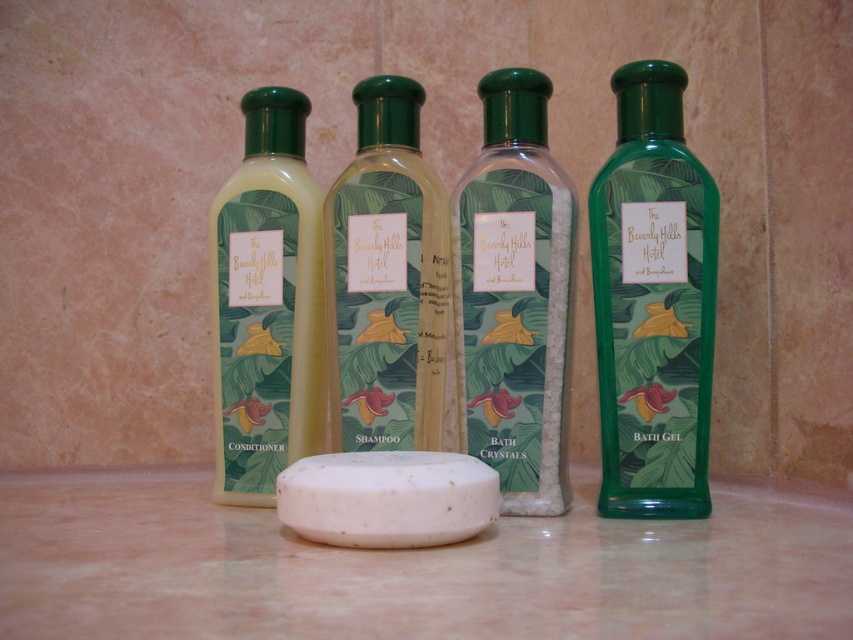
Is point (425, 404) more distant than point (331, 476)?

That is True.

Is green matte shampoo at center shorter than white matte soap at center?

No.

Which is behind, point (387, 435) or point (322, 512)?

The point (387, 435) is behind.

This screenshot has height=640, width=853. What are the coordinates of `green matte shampoo at center` in the screenshot? It's located at (386, 280).

Is green matte bath crystals at center to the right of green matte shampoo at center from the viewer's perspective?

Indeed, green matte bath crystals at center is positioned on the right side of green matte shampoo at center.

Does point (524, 145) come behind point (367, 342)?

No.

What do you see at coordinates (514, 296) in the screenshot?
I see `green matte bath crystals at center` at bounding box center [514, 296].

Locate an element on the screen. Image resolution: width=853 pixels, height=640 pixels. green matte bath crystals at center is located at coordinates (514, 296).

Is point (509, 196) positioned before point (373, 536)?

No, (509, 196) is further to viewer.

In order to click on green matte bath crystals at center in this screenshot , I will do `click(514, 296)`.